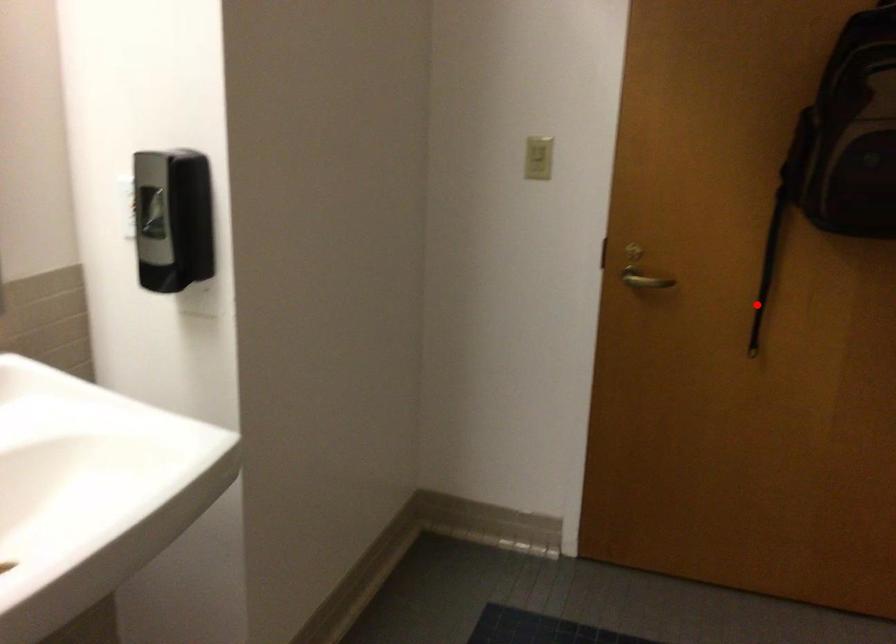
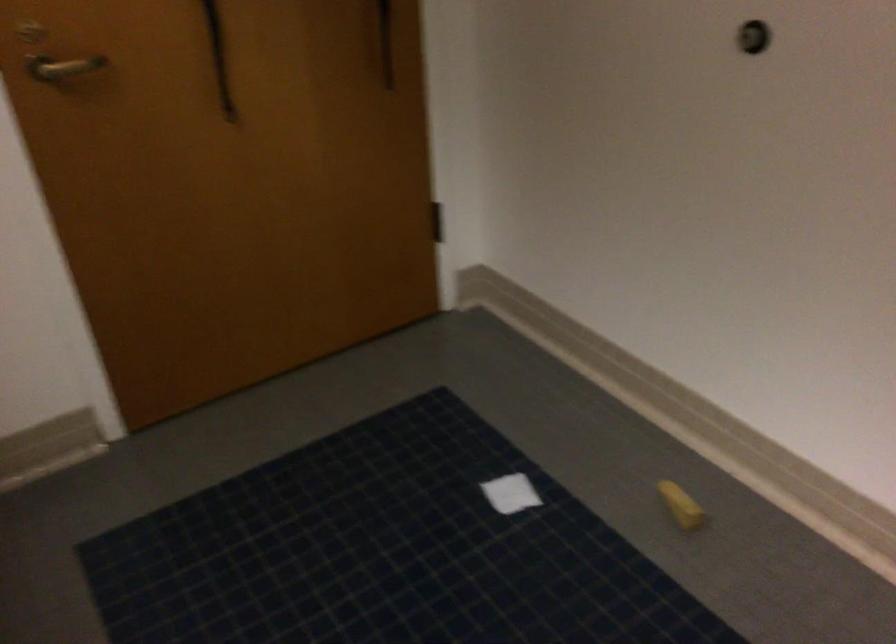
Locate, in the second image, the point that corresponds to the highlighted location in the first image.

(219, 58)